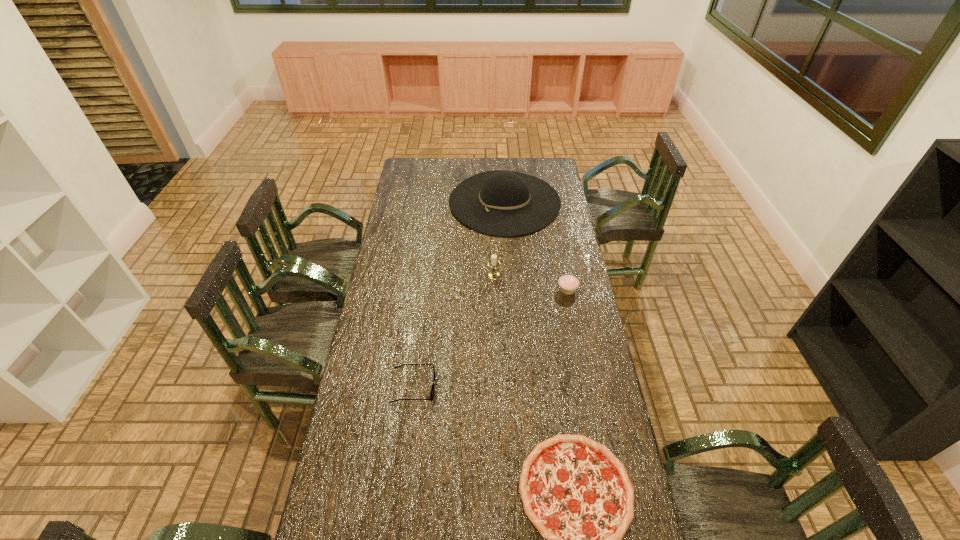
You are a GUI agent. You are given a task and a screenshot of the screen. Output one action in this format:
    pyautogui.click(x=<x>, y=<y>)
    Task: Click on the free spot located 0.390m on the front of the third nearest object
    
    Given the screenshot: What is the action you would take?
    pyautogui.click(x=585, y=376)

This screenshot has width=960, height=540. I want to click on free region located on the front-facing side of the second nearest object, so click(494, 387).

Where is `object located in the far edge section of the desktop`? object located in the far edge section of the desktop is located at coordinates (500, 203).

I want to click on object positioned at the left edge, so click(432, 391).

At what (x,y) coordinates should I click in order to perform the action: click on sombrero that is positioned at the right edge. Please return your answer as a coordinate pair (x, y). Looking at the image, I should click on (500, 203).

The width and height of the screenshot is (960, 540). I want to click on cupcake present at the right edge, so click(568, 284).

Where is `object situated at the far right corner`? The image size is (960, 540). object situated at the far right corner is located at coordinates (500, 203).

Locate an element on the screen. free location at the far edge of the desktop is located at coordinates (521, 165).

In the image, there is a desktop. Identify the location of vacant space at the left edge. The height and width of the screenshot is (540, 960). (370, 335).

In the image, there is a desktop. Where is `vacant space at the right edge`? Image resolution: width=960 pixels, height=540 pixels. vacant space at the right edge is located at coordinates (612, 453).